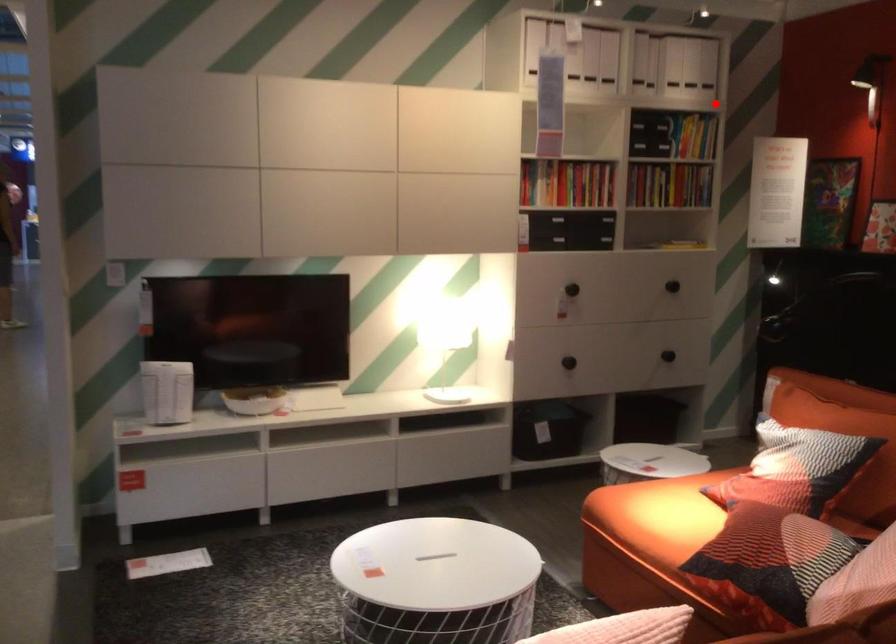
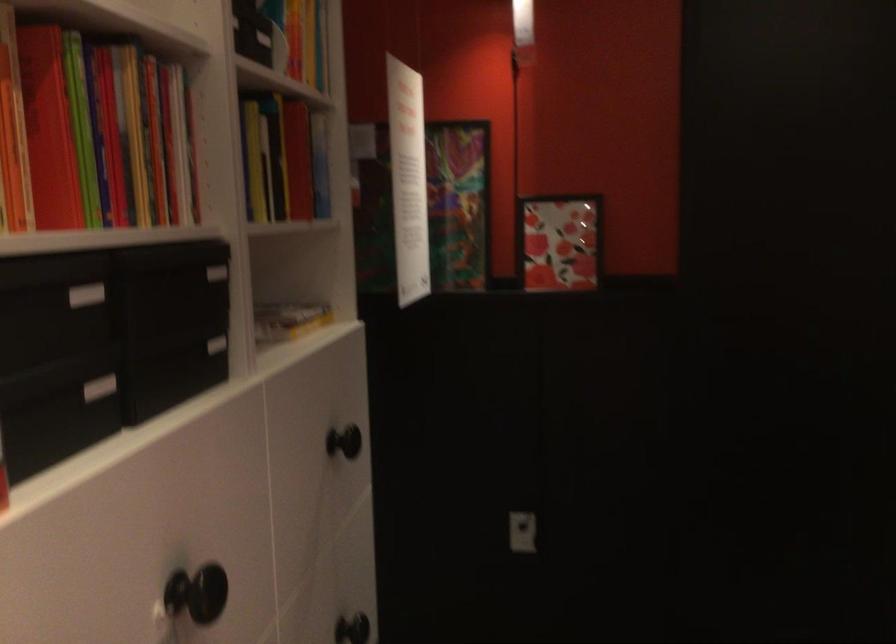
Question: A red point is marked in image1. In image2, is the corresponding 3D point closer to the camera or farther? Reply with the corresponding letter.

Choices:
 (A) The corresponding 3D point is closer.
 (B) The corresponding 3D point is farther.

Answer: (A)